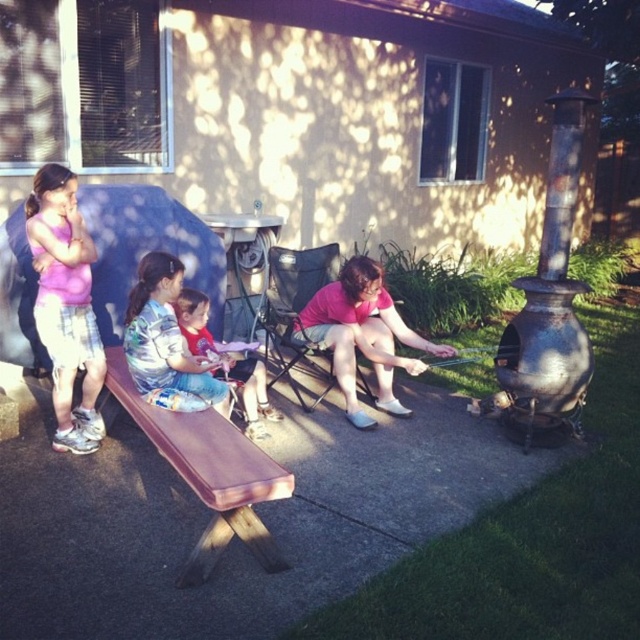
Does brown wood bench at left appear on the right side of blue denim shorts at center?

No, brown wood bench at left is not to the right of blue denim shorts at center.

Does brown wood bench at left come in front of blue denim shorts at center?

Yes.

At what (x,y) coordinates should I click in order to perform the action: click on brown wood bench at left. Please return your answer as a coordinate pair (x, y). Looking at the image, I should click on (208, 472).

Where is `brown wood bench at left`? This screenshot has width=640, height=640. brown wood bench at left is located at coordinates (208, 472).

The height and width of the screenshot is (640, 640). What do you see at coordinates (362, 333) in the screenshot?
I see `pink matte shorts at center` at bounding box center [362, 333].

Who is positioned more to the right, pink matte shorts at center or blue denim shorts at center?

pink matte shorts at center

Find the location of `pink matte shorts at center`. pink matte shorts at center is located at coordinates (362, 333).

The width and height of the screenshot is (640, 640). Describe the element at coordinates (362, 333) in the screenshot. I see `pink matte shorts at center` at that location.

Consider the image. Does pink matte shorts at center appear under red shirt at center?

Actually, pink matte shorts at center is above red shirt at center.

Is point (305, 330) farther from camera compared to point (195, 332)?

Yes, point (305, 330) is farther from viewer.

You are a GUI agent. You are given a task and a screenshot of the screen. Output one action in this format:
    pyautogui.click(x=<x>, y=<y>)
    Task: Click on the pink matte shorts at center
    The width and height of the screenshot is (640, 640).
    Given the screenshot: What is the action you would take?
    pyautogui.click(x=362, y=333)